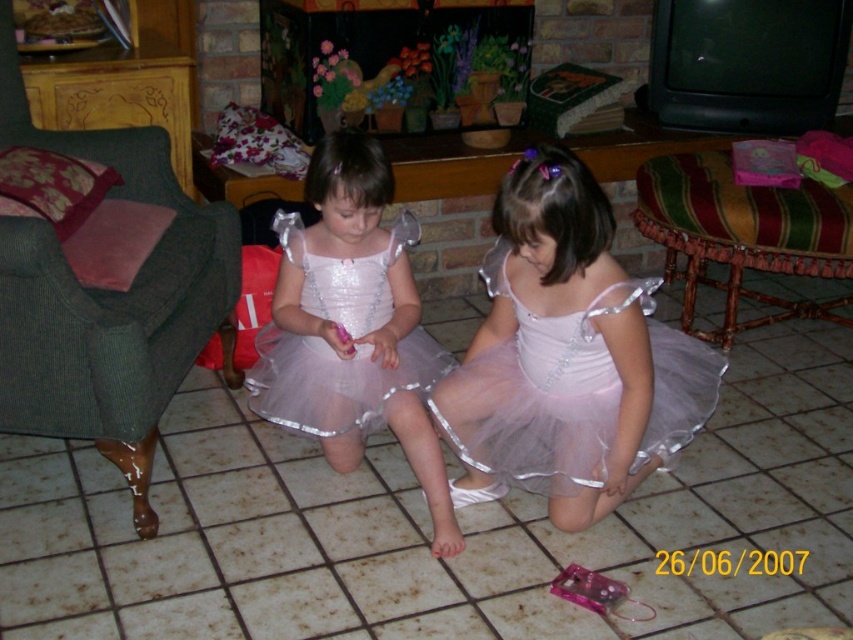
Does point (518, 435) lie behind point (780, 232)?

No, (518, 435) is closer to viewer.

Which of these two, pink tulle dress at center or striped fabric cushion at right, stands shorter?

pink tulle dress at center is shorter.

Does point (612, 413) come behind point (694, 292)?

No, (612, 413) is closer to viewer.

Identify the location of pink tulle dress at center. This screenshot has height=640, width=853. (569, 390).

Can you confirm if green fabric armchair at left is bigger than matte pink tulle dress at center?

Correct, green fabric armchair at left is larger in size than matte pink tulle dress at center.

Describe the element at coordinates (107, 292) in the screenshot. I see `green fabric armchair at left` at that location.

Between point (22, 120) and point (439, 358), which one is positioned behind?

Point (22, 120)

You are a GUI agent. You are given a task and a screenshot of the screen. Output one action in this format:
    pyautogui.click(x=<x>, y=<y>)
    Task: Click on the green fabric armchair at left
    
    Given the screenshot: What is the action you would take?
    pyautogui.click(x=107, y=292)

Can you confirm if pink tulle dress at center is wider than matte pink tulle dress at center?

Yes.

Is pink tulle dress at center to the left of matte pink tulle dress at center from the viewer's perspective?

Incorrect, pink tulle dress at center is not on the left side of matte pink tulle dress at center.

Image resolution: width=853 pixels, height=640 pixels. I want to click on pink tulle dress at center, so click(x=569, y=390).